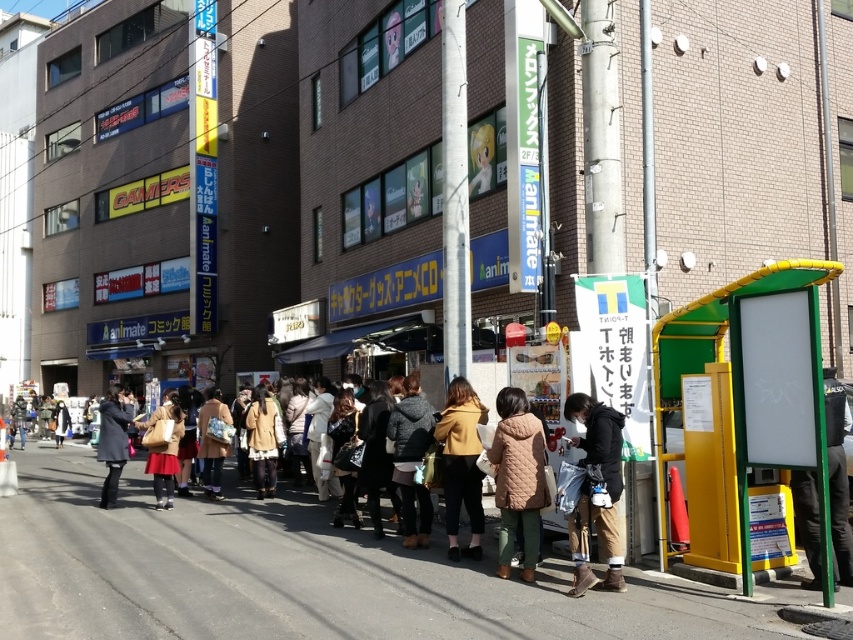
You are a person looking at the group of people near the yellow and green kiosk in the bustling urban street scene. You notice two items of clothing at the center of the scene. Which clothing item is covering the other one, the matte brown skirt at center or the matte gray coat at center?

The matte brown skirt at center is positioned over the matte gray coat at center, meaning it is covering the coat.

You are a fashion designer observing the scene. You notice the brown suede boots at lower right and the matte brown skirt at center. Which item is taller in height?

The brown suede boots at lower right has a greater height compared to matte brown skirt at center.